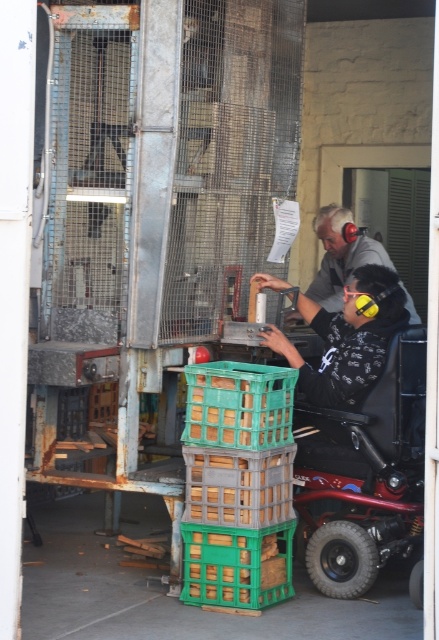
Who is higher up, red metallic wheelchair at lower right or gray fabric shirt at upper right?

→ Positioned higher is gray fabric shirt at upper right.

Who is more distant from viewer, (x=308, y=492) or (x=339, y=280)?

Point (x=339, y=280)

Which is in front, point (326, 460) or point (327, 205)?

Positioned in front is point (326, 460).

You are a GUI agent. You are given a task and a screenshot of the screen. Output one action in this format:
    pyautogui.click(x=<x>, y=<y>)
    Task: Click on the red metallic wheelchair at lower right
    Image resolution: width=439 pixels, height=640 pixels.
    Given the screenshot: What is the action you would take?
    pyautogui.click(x=363, y=474)